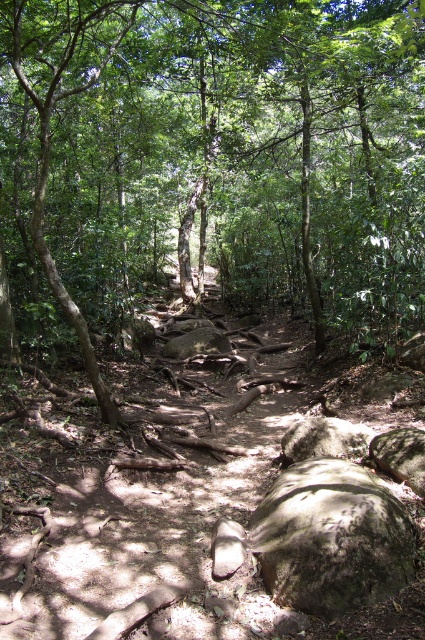
You are hiking on a forest trail and see a rough gray rock at lower right and a smooth gray rock at center. Which rock is positioned more to the east if you are facing north?

The rough gray rock at lower right is positioned to the right of the smooth gray rock at center. Since you are facing north, the right side corresponds to the east direction. Therefore, the rough gray rock at lower right is more to the east than the smooth gray rock at center.

You are a hiker walking along the forest trail. You notice a green leafy tree at center and a smooth gray rock at center. Which object would block your view of the other if you were standing at the starting point of the trail?

The green leafy tree at center is in front of the smooth gray rock at center, so the tree would block your view of the rock if you were standing at the starting point of the trail.

You are a hiker walking along the forest trail and want to take a photo of both the green leafy tree at center and the smooth gray rock at center. Which object should you position to your left side in the camera frame to capture both in the shot?

To capture both the green leafy tree at center and the smooth gray rock at center in the photo, you should position the green leafy tree at center to your left side in the camera frame since it is located to the left of the smooth gray rock at center.